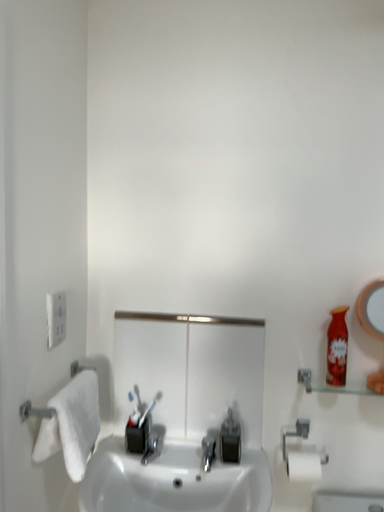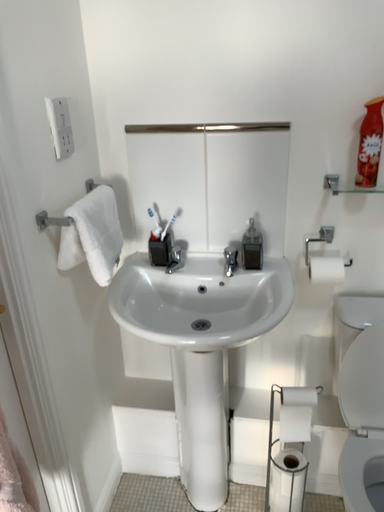
Question: Which way did the camera rotate in the video?

Choices:
 (A) rotated upward
 (B) rotated downward

Answer: (B)